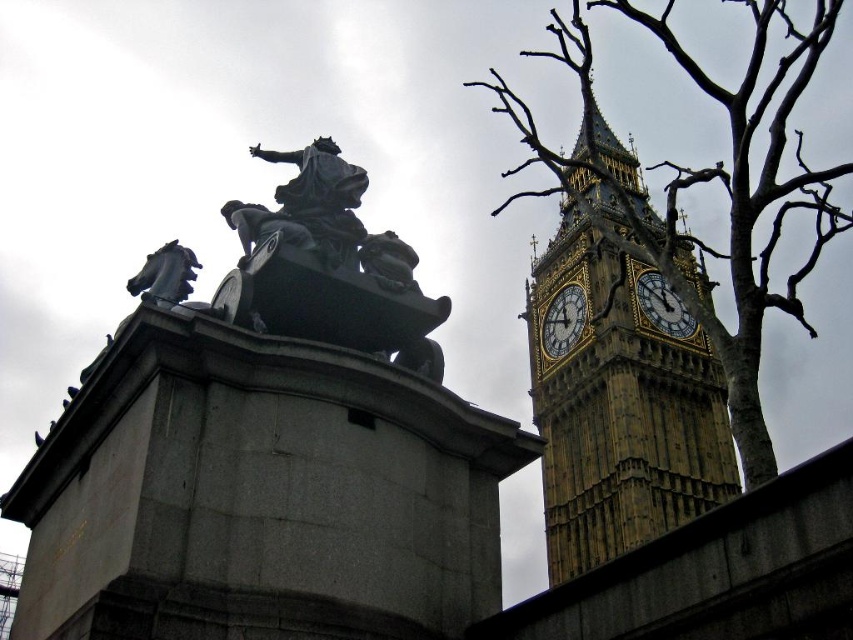
Can you confirm if bronze statue at center is smaller than gold textured clock at upper right?

Incorrect, bronze statue at center is not smaller in size than gold textured clock at upper right.

Which is more to the right, bronze statue at center or gold textured clock at upper right?

gold textured clock at upper right is more to the right.

Describe the element at coordinates (306, 204) in the screenshot. Image resolution: width=853 pixels, height=640 pixels. I see `bronze statue at center` at that location.

This screenshot has height=640, width=853. Find the location of `bronze statue at center`. bronze statue at center is located at coordinates (306, 204).

Is bare branches at upper right taller than bronze statue at center?

Yes.

Does bare branches at upper right appear on the right side of bronze statue at center?

Correct, you'll find bare branches at upper right to the right of bronze statue at center.

Where is `bare branches at upper right`? The image size is (853, 640). bare branches at upper right is located at coordinates (708, 180).

Is golden stone clock tower at upper right shorter than gold/yellow metal big ben at right?

Incorrect, golden stone clock tower at upper right's height does not fall short of gold/yellow metal big ben at right's.

Who is lower down, golden stone clock tower at upper right or gold/yellow metal big ben at right?

gold/yellow metal big ben at right is below.

Is point (547, 452) closer to viewer compared to point (665, 317)?

Yes, it is in front of point (665, 317).

At what (x,y) coordinates should I click in order to perform the action: click on golden stone clock tower at upper right. Please return your answer as a coordinate pair (x, y). Looking at the image, I should click on point(619,410).